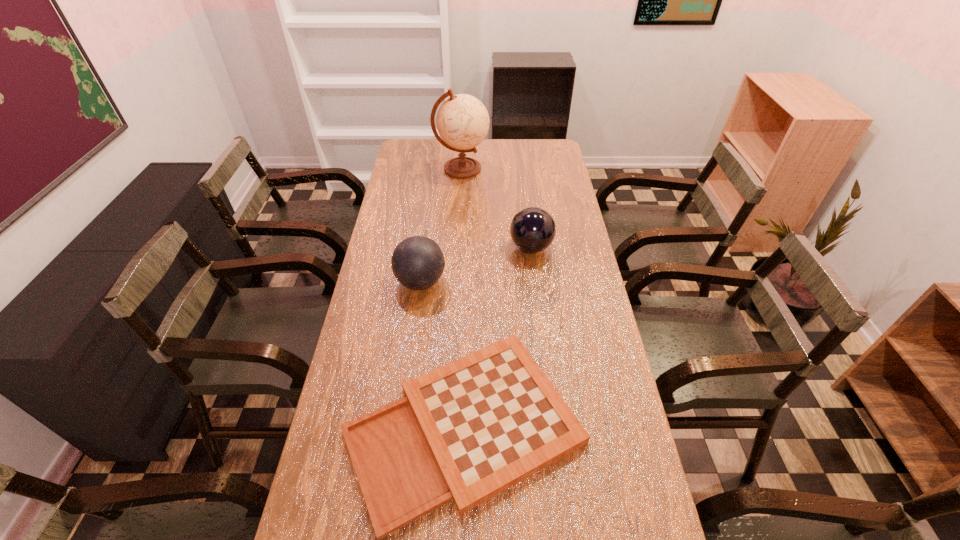
The image size is (960, 540). Identify the location of blank region between the second farthest object and the globe. pos(496,208).

Find the location of a particular element. The width and height of the screenshot is (960, 540). empty space that is in between the left bowling ball and the farthest object is located at coordinates (441, 225).

Where is `free spot between the tallest object and the left bowling ball`? free spot between the tallest object and the left bowling ball is located at coordinates (441, 225).

Where is `vacant space in between the tallest object and the left bowling ball`? vacant space in between the tallest object and the left bowling ball is located at coordinates (441, 225).

Where is `vacant area that lies between the third nearest object and the second nearest object`? vacant area that lies between the third nearest object and the second nearest object is located at coordinates (476, 265).

Find the location of `free spot between the farther bowling ball and the tallest object`. free spot between the farther bowling ball and the tallest object is located at coordinates (496, 208).

Where is `object that is the third closest to the third farthest object`? object that is the third closest to the third farthest object is located at coordinates (462, 121).

In order to click on object identified as the closest to the shortest object in this screenshot , I will do `click(417, 262)`.